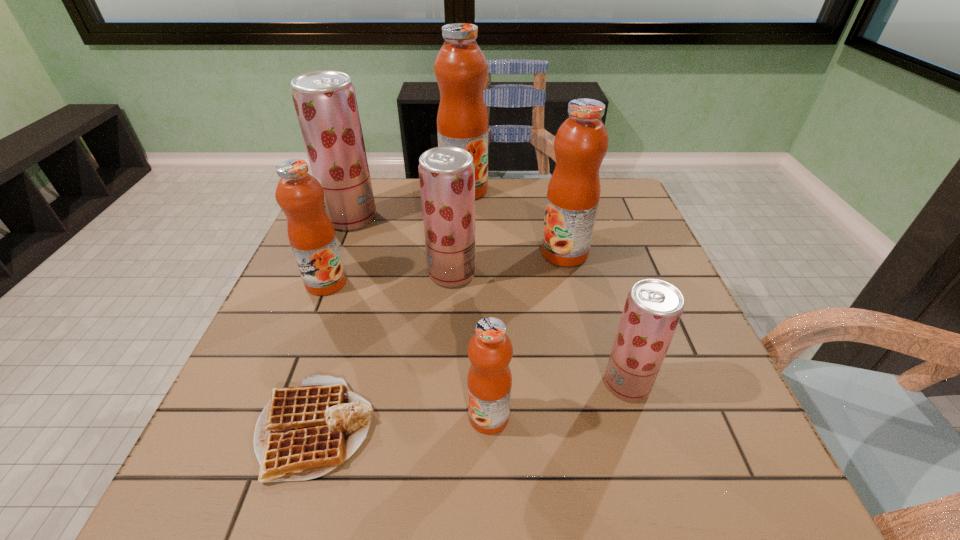
Where is `the third closest strawberry fruit juice to the shortest object`? the third closest strawberry fruit juice to the shortest object is located at coordinates (325, 102).

Find the location of `blank space that satisfies the following two spatial constraints: 1. on the front label of the leftmost orange fruit juice; 2. on the left side of the shortest object`. blank space that satisfies the following two spatial constraints: 1. on the front label of the leftmost orange fruit juice; 2. on the left side of the shortest object is located at coordinates pyautogui.click(x=269, y=428).